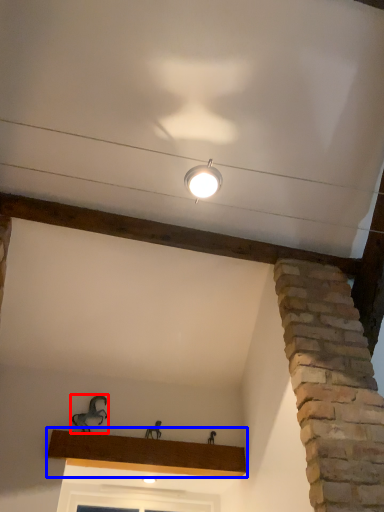
Question: Among these objects, which one is nearest to the camera, animal (highlighted by a red box) or window sill (highlighted by a blue box)?

Choices:
 (A) animal
 (B) window sill

Answer: (B)